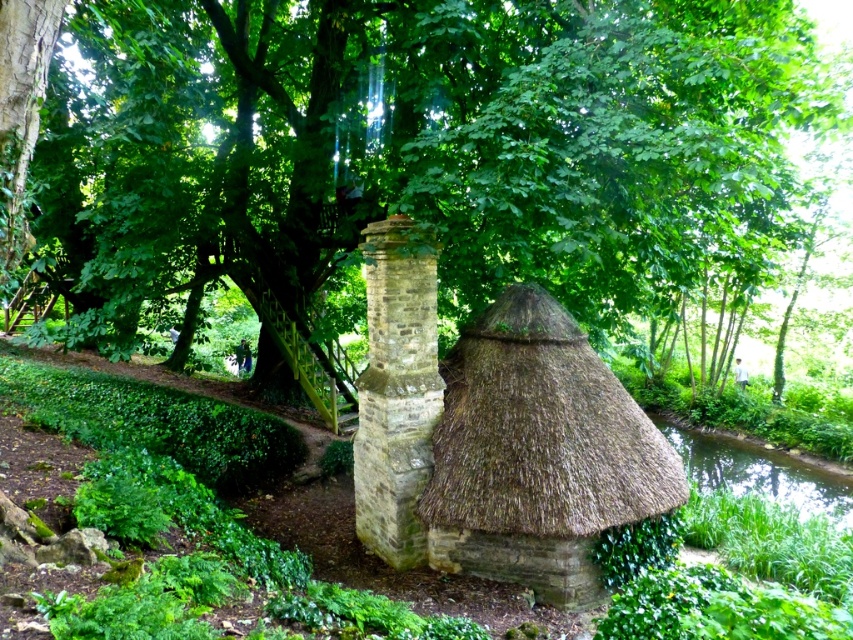
Question: Considering the relative positions of brown thatch roof at center and brown stone chimney at center in the image provided, where is brown thatch roof at center located with respect to brown stone chimney at center?

Choices:
 (A) left
 (B) right

Answer: (B)

Question: Which is farther from the brown stone chimney at center?

Choices:
 (A) green grassy bank at lower right
 (B) brown thatch roof at center

Answer: (A)

Question: Which point is farther to the camera?

Choices:
 (A) green leafy tree at center
 (B) green grassy bank at lower right
 (C) brown thatch roof at center
 (D) brown stone chimney at center

Answer: (B)

Question: Is brown thatch roof at center to the left of brown stone chimney at center from the viewer's perspective?

Choices:
 (A) yes
 (B) no

Answer: (B)

Question: Among these points, which one is nearest to the camera?

Choices:
 (A) (368, 392)
 (B) (543, 328)

Answer: (A)

Question: Can you confirm if brown stone chimney at center is positioned to the left of green grassy bank at lower right?

Choices:
 (A) yes
 (B) no

Answer: (A)